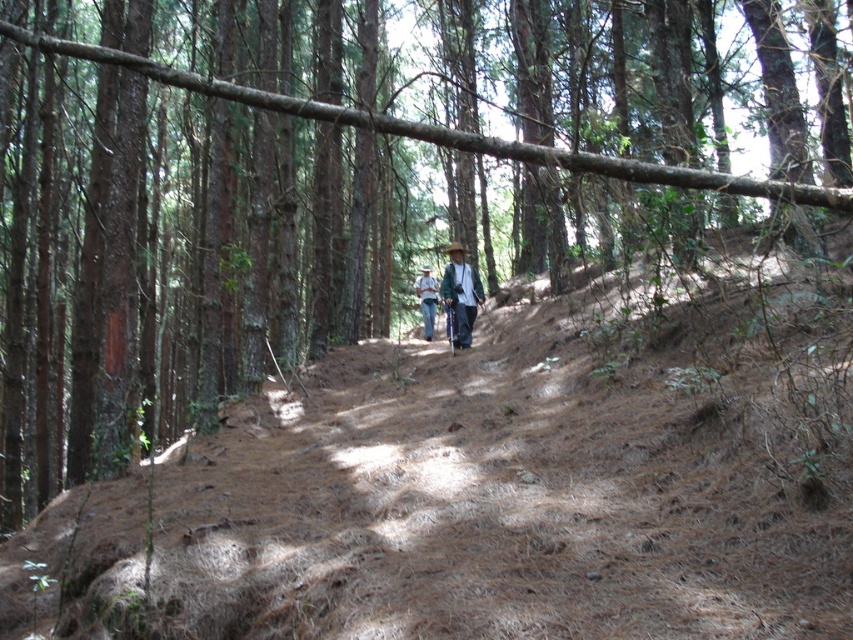
Question: From the image, what is the correct spatial relationship of wooden walking stick at center in relation to camouflage fabric shirt at center?

Choices:
 (A) above
 (B) below

Answer: (A)

Question: Among these points, which one is farthest from the camera?

Choices:
 (A) (432, 296)
 (B) (456, 310)

Answer: (A)

Question: Can you confirm if wooden walking stick at center is positioned above camouflage fabric shirt at center?

Choices:
 (A) yes
 (B) no

Answer: (A)

Question: Which object is farther from the camera taking this photo?

Choices:
 (A) wooden walking stick at center
 (B) camouflage fabric shirt at center

Answer: (B)

Question: Can you confirm if wooden walking stick at center is positioned below camouflage fabric shirt at center?

Choices:
 (A) yes
 (B) no

Answer: (B)